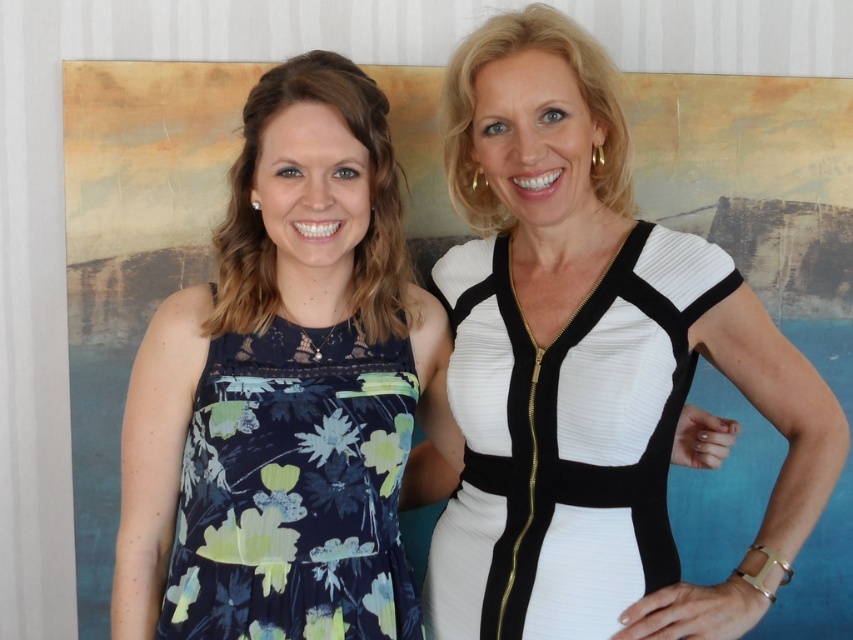
Question: Does white matte dress at center have a greater width compared to floral-patterned fabric dress at left?

Choices:
 (A) yes
 (B) no

Answer: (A)

Question: Considering the real-world distances, which object is closest to the white matte dress at center?

Choices:
 (A) floral dress at left
 (B) white textured dress at center
 (C) floral-patterned fabric dress at left

Answer: (B)

Question: Among these points, which one is farthest from the camera?

Choices:
 (A) (515, 568)
 (B) (444, 588)
 (C) (224, 337)
 (D) (148, 580)

Answer: (B)

Question: Can you confirm if white matte dress at center is positioned above floral dress at left?

Choices:
 (A) yes
 (B) no

Answer: (A)

Question: Can you confirm if white textured dress at center is smaller than floral-patterned fabric dress at left?

Choices:
 (A) yes
 (B) no

Answer: (B)

Question: Which of these objects is positioned closest to the floral-patterned fabric dress at left?

Choices:
 (A) white textured dress at center
 (B) white matte dress at center

Answer: (A)